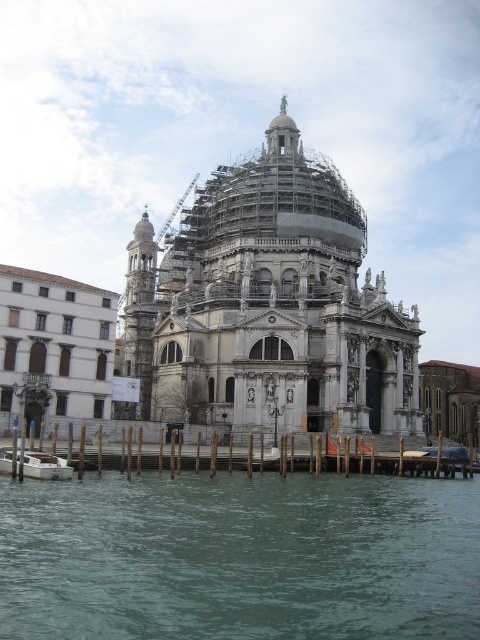
The width and height of the screenshot is (480, 640). Describe the element at coordinates (240, 556) in the screenshot. I see `greenish water at lower center` at that location.

At what (x,y) coordinates should I click in order to perform the action: click on greenish water at lower center. Please return your answer as a coordinate pair (x, y). The image size is (480, 640). Looking at the image, I should click on (240, 556).

Is greenish water at lower center shorter than white glossy boat at lower left?

No.

Who is lower down, greenish water at lower center or white glossy boat at lower left?

greenish water at lower center

Who is more forward, (360, 627) or (9, 452)?

Point (360, 627) is in front.

Where is `greenish water at lower center`? greenish water at lower center is located at coordinates (240, 556).

Does white marble dome at center appear on the right side of white glossy boat at lower left?

Yes, white marble dome at center is to the right of white glossy boat at lower left.

Which of these two, white marble dome at center or white glossy boat at lower left, stands taller?

white marble dome at center

The image size is (480, 640). Identify the location of white marble dome at center. 268,305.